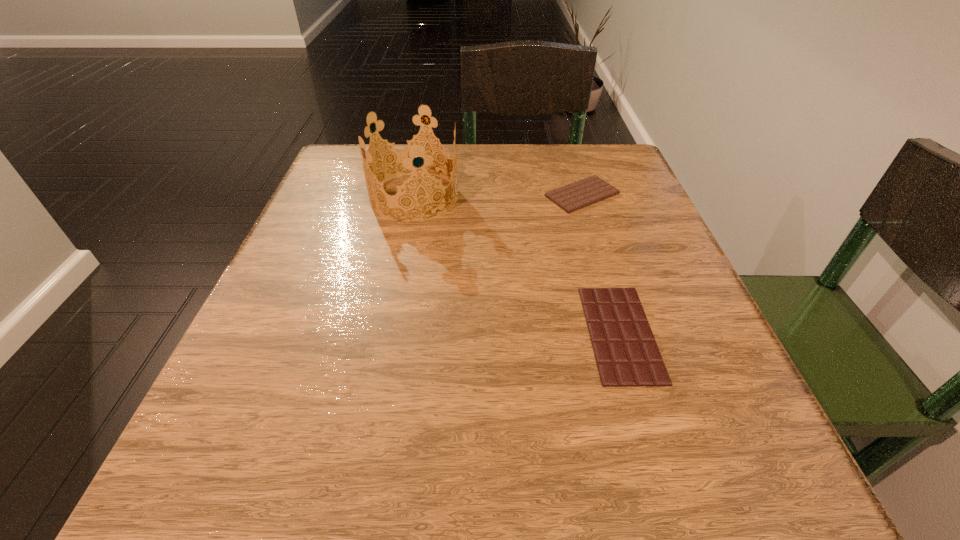
Identify the location of chocolate bar at the far edge. (580, 194).

The width and height of the screenshot is (960, 540). Find the location of `object that is at the left edge`. object that is at the left edge is located at coordinates (408, 152).

The width and height of the screenshot is (960, 540). Identify the location of object present at the far left corner. (408, 152).

Identify the location of object at the far right corner. (580, 194).

At what (x,y) coordinates should I click in order to perform the action: click on free spot at the far edge of the desktop. Please return your answer as a coordinate pair (x, y). Looking at the image, I should click on (465, 189).

Where is `vacant space at the near edge of the desktop`? vacant space at the near edge of the desktop is located at coordinates (568, 470).

You are a GUI agent. You are given a task and a screenshot of the screen. Output one action in this format:
    pyautogui.click(x=<x>, y=<y>)
    Task: Click on the vacant space at the left edge of the desktop
    The height and width of the screenshot is (540, 960).
    Given the screenshot: What is the action you would take?
    pyautogui.click(x=345, y=256)

You are a GUI agent. You are given a task and a screenshot of the screen. Output one action in this format:
    pyautogui.click(x=<x>, y=<y>)
    Task: Click on the vacant space at the right edge
    The width and height of the screenshot is (960, 540).
    Given the screenshot: What is the action you would take?
    pyautogui.click(x=712, y=372)

At what (x,y) coordinates should I click in order to perform the action: click on free space at the far left corner of the desktop. Please return your answer as a coordinate pair (x, y). This screenshot has height=540, width=960. Looking at the image, I should click on (342, 186).

Locate an element on the screen. The width and height of the screenshot is (960, 540). free space at the near left corner of the desktop is located at coordinates (253, 483).